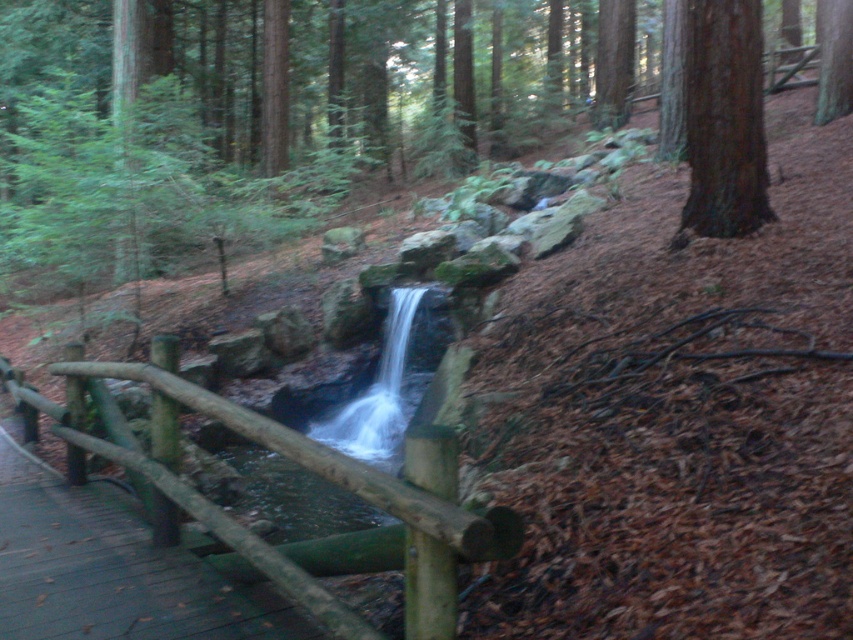
Does wooden walkway at lower left have a lesser height compared to green rough bark tree at upper right?

Correct, wooden walkway at lower left is not as tall as green rough bark tree at upper right.

Who is higher up, wooden walkway at lower left or green rough bark tree at upper right?

green rough bark tree at upper right

Does point (22, 609) come in front of point (820, 52)?

Yes, point (22, 609) is in front of point (820, 52).

Locate an element on the screen. This screenshot has height=640, width=853. wooden walkway at lower left is located at coordinates (111, 570).

Who is shorter, wooden fence at center or brown rough bark tree at upper right?

With less height is wooden fence at center.

Does point (344, 564) come closer to viewer compared to point (741, 161)?

Yes, point (344, 564) is in front of point (741, 161).

In order to click on wooden fence at center in this screenshot , I will do `click(286, 458)`.

Which is more to the left, green mossy rock at center or wooden fence at center?

wooden fence at center

Based on the photo, who is positioned more to the right, green mossy rock at center or wooden fence at center?

green mossy rock at center is more to the right.

Is point (219, 52) farther from viewer compared to point (502, 513)?

Yes.

Find the location of `green mossy rock at center`. green mossy rock at center is located at coordinates (338, 104).